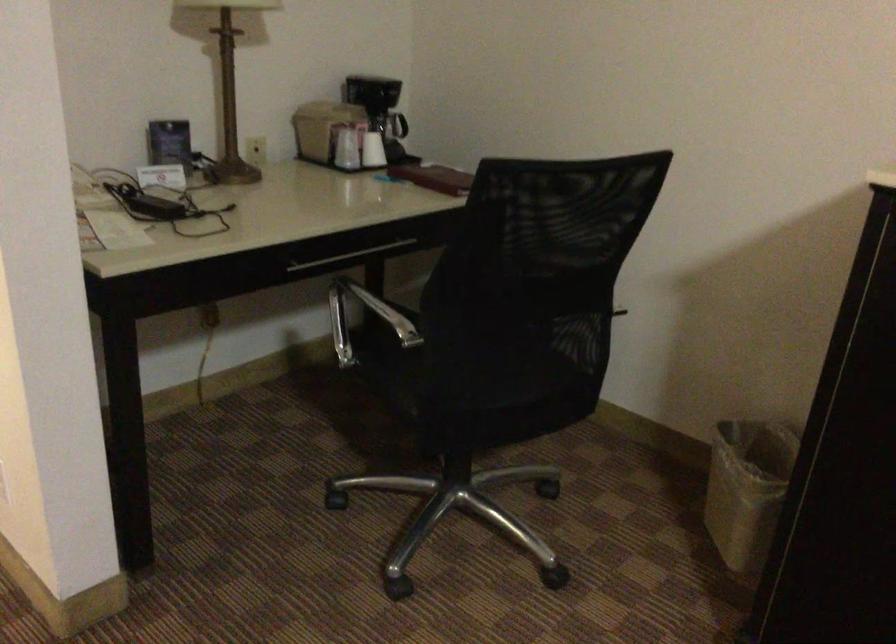
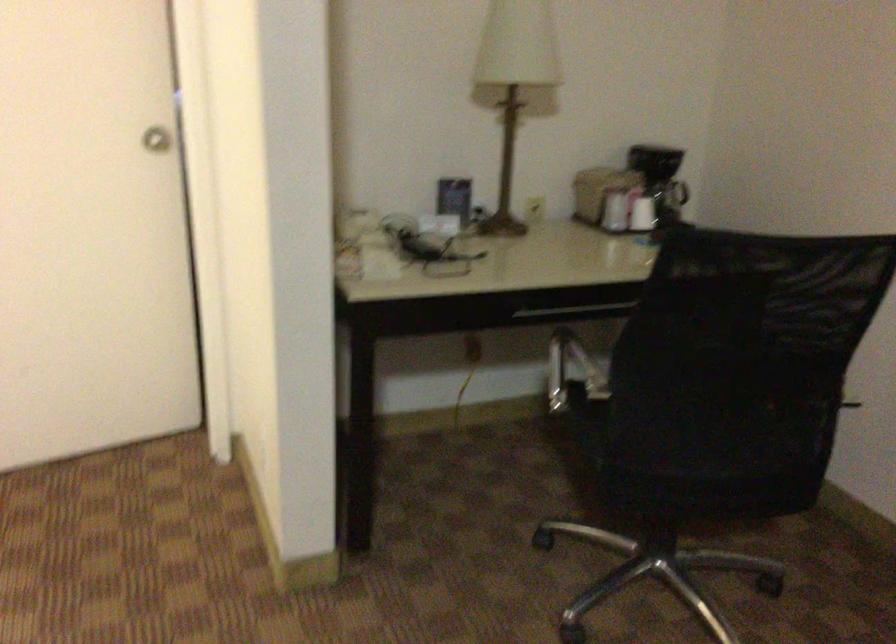
In the second image, find the point that corresponds to point 392,138 in the first image.

(677, 202)